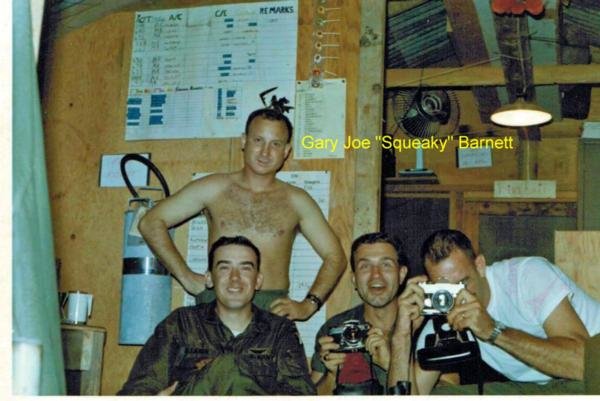
This screenshot has width=600, height=401. I want to click on shaft of fan, so (421, 158).